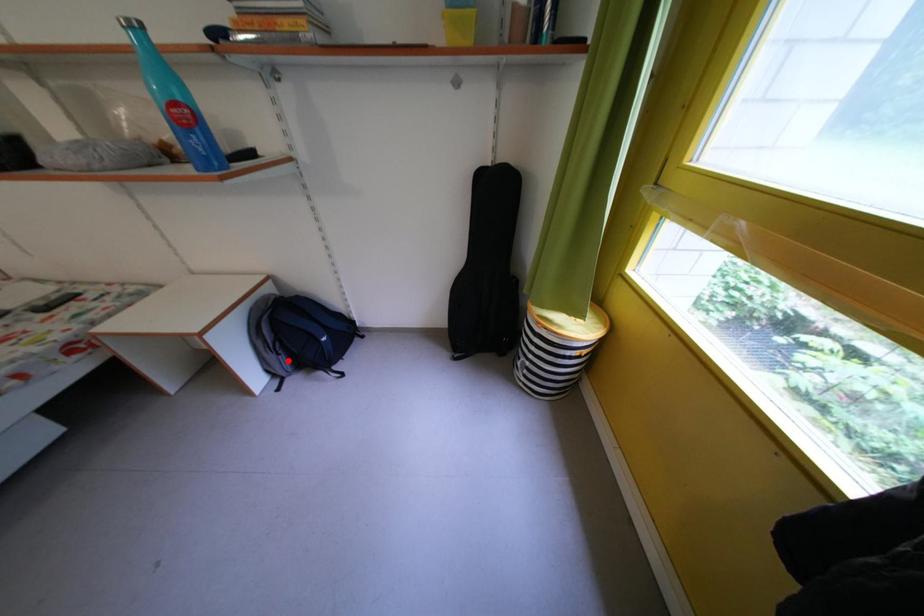
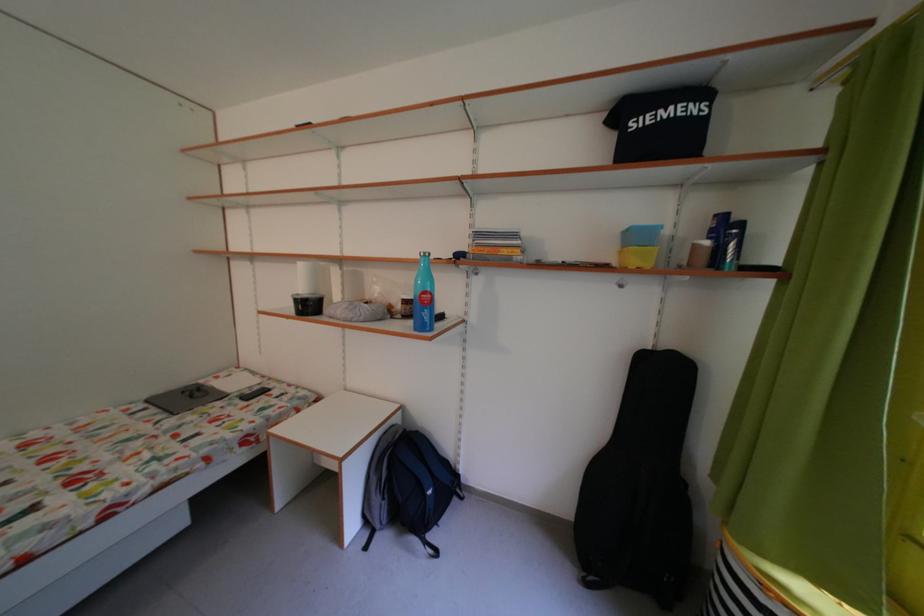
Where in the second image is the point corresponding to the highlighted location from the first image?

(393, 504)